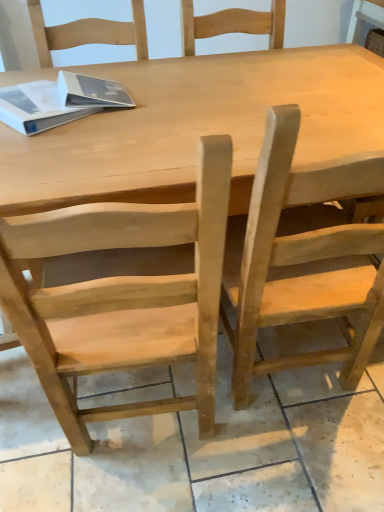
Find the location of a particular element. The height and width of the screenshot is (512, 384). vacant space in front of white matte book at upper left is located at coordinates (47, 147).